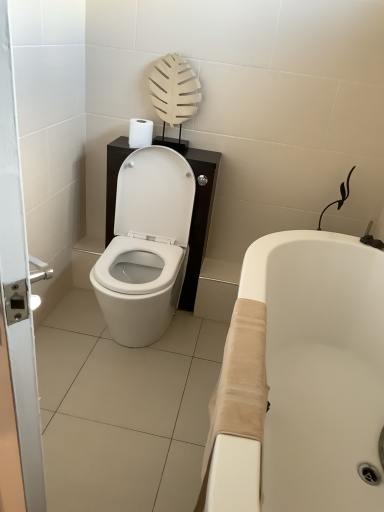
Question: Is beige fabric bathtub at lower right spatially inside white glossy door at left, or outside of it?

Choices:
 (A) outside
 (B) inside

Answer: (A)

Question: Is point (306, 453) closer or farther from the camera than point (0, 114)?

Choices:
 (A) closer
 (B) farther

Answer: (B)

Question: Estimate the real-world distances between objects in this image. Which object is farther from the beige fabric bathtub at lower right?

Choices:
 (A) white matte toilet paper at upper center
 (B) white glossy toilet at center
 (C) white glossy door at left

Answer: (A)

Question: Based on their relative distances, which object is farther from the white matte toilet paper at upper center?

Choices:
 (A) white glossy toilet at center
 (B) beige fabric bathtub at lower right
 (C) white glossy door at left

Answer: (C)